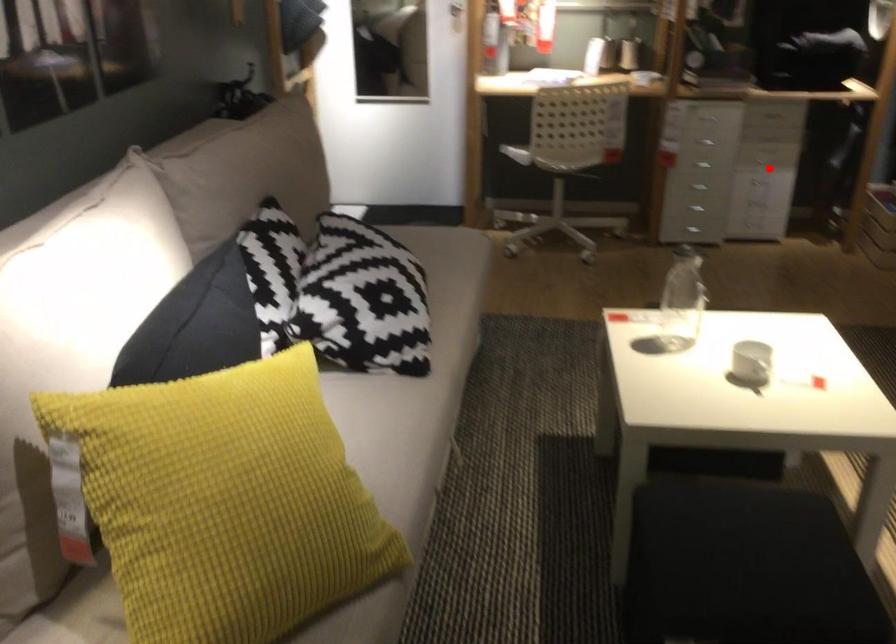
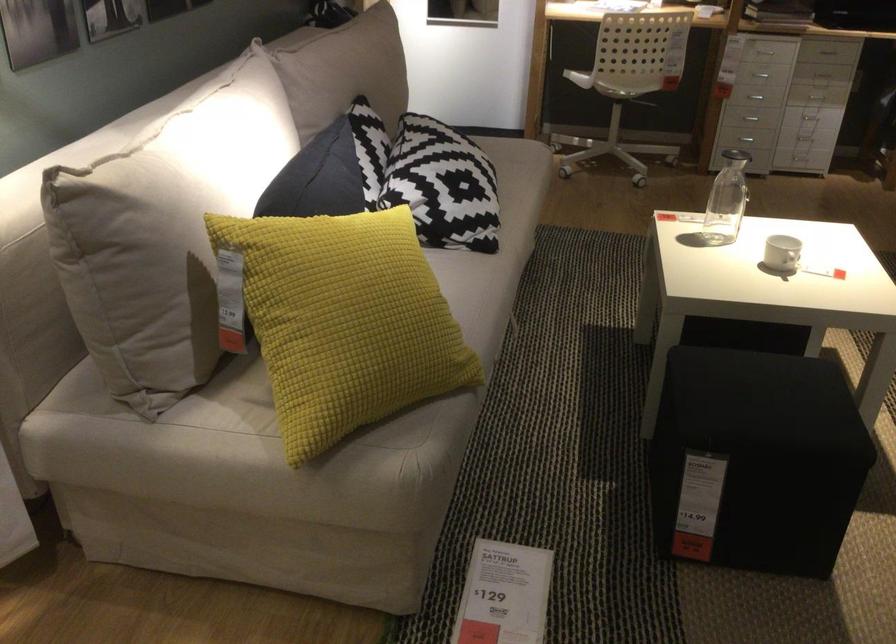
Locate, in the second image, the point that corresponds to the highlighted location in the first image.

(815, 96)